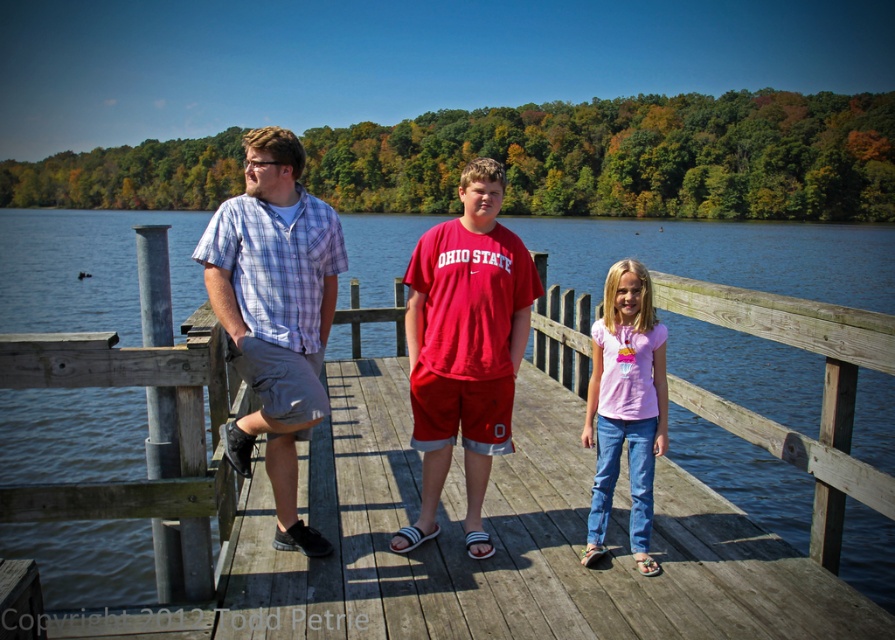
You are a photographer standing on the wooden dock. You want to take a photo of the plaid cotton shirt at center and the pink cotton shirt at center such that both are in focus. The camera you are using has a depth of field that can cover 6 feet. Will both shirts be in focus in the photo?

The plaid cotton shirt at center and pink cotton shirt at center are 6.21 feet apart from each other. Since the camera can only cover 6 feet, the distance between them exceeds the depth of field capacity. Therefore, both shirts cannot be in focus simultaneously.